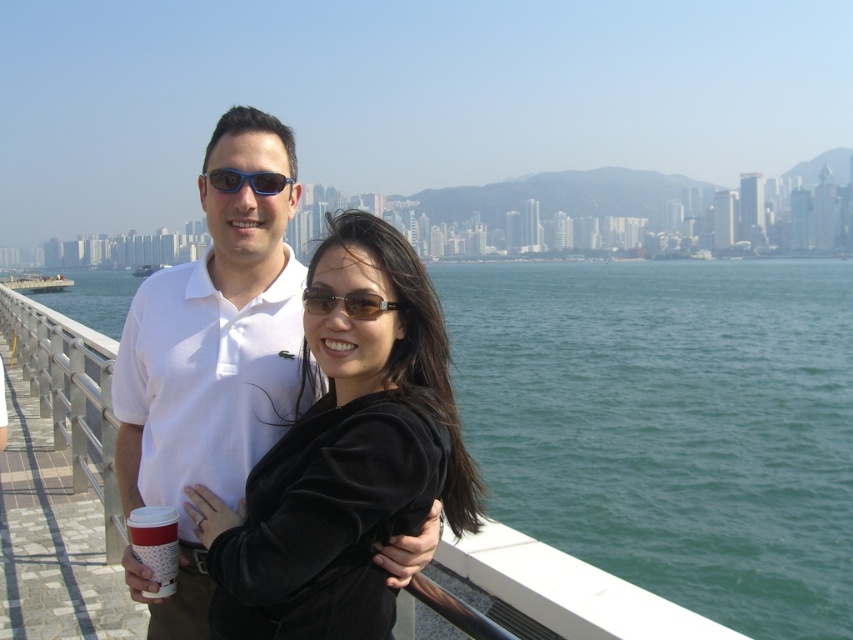
Question: Is white cotton polo shirt at center bigger than brown matte sunglasses at center?

Choices:
 (A) yes
 (B) no

Answer: (A)

Question: Among these points, which one is farthest from the camera?

Choices:
 (A) (329, 289)
 (B) (200, 317)

Answer: (B)

Question: Is green water at center wider than blue plastic sunglasses at center?

Choices:
 (A) no
 (B) yes

Answer: (B)

Question: Does black velvet jacket at center appear on the right side of white paper cup at lower left?

Choices:
 (A) yes
 (B) no

Answer: (A)

Question: Estimate the real-world distances between objects in this image. Which object is closer to the green water at center?

Choices:
 (A) white cotton polo shirt at center
 (B) white paper cup at lower left
 (C) brown matte sunglasses at center

Answer: (B)

Question: Estimate the real-world distances between objects in this image. Which object is farther from the green water at center?

Choices:
 (A) blue plastic sunglasses at center
 (B) black velvet jacket at center
 (C) white paper cup at lower left
 (D) white cotton polo shirt at center

Answer: (D)